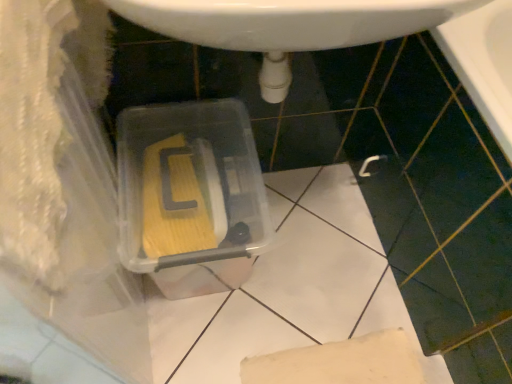
Question: Is point (291, 16) positioned closer to the camera than point (211, 203)?

Choices:
 (A) farther
 (B) closer

Answer: (B)

Question: Considering their positions, is white glossy sink at center located in front of or behind transparent plastic storage box at center?

Choices:
 (A) behind
 (B) front

Answer: (B)

Question: Considering the positions of white glossy sink at center and transparent plastic storage box at center in the image, is white glossy sink at center wider or thinner than transparent plastic storage box at center?

Choices:
 (A) wide
 (B) thin

Answer: (B)

Question: From a real-world perspective, is transparent plastic storage box at center physically located above or below white glossy sink at center?

Choices:
 (A) below
 (B) above

Answer: (A)

Question: Looking at their shapes, would you say transparent plastic storage box at center is wider or thinner than white glossy sink at center?

Choices:
 (A) wide
 (B) thin

Answer: (A)

Question: Considering the positions of transparent plastic storage box at center and white glossy sink at center in the image, is transparent plastic storage box at center taller or shorter than white glossy sink at center?

Choices:
 (A) short
 (B) tall

Answer: (B)

Question: Considering the positions of point (183, 238) and point (448, 1), is point (183, 238) closer or farther from the camera than point (448, 1)?

Choices:
 (A) farther
 (B) closer

Answer: (A)